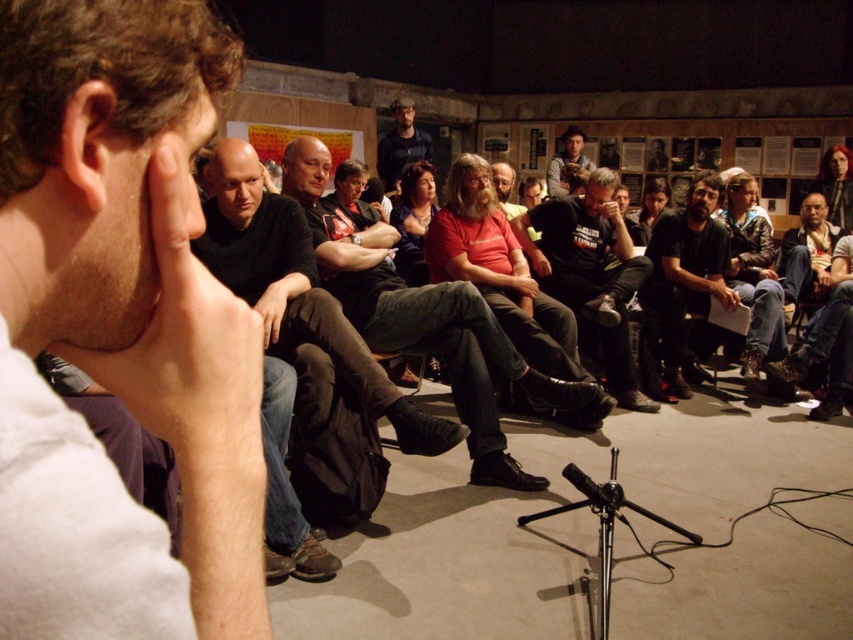
In the scene shown: You are organizing a photo shoot and need to arrange two models wearing the dark gray sweater at center and the dark blue shirt at center. Based on their current positions and sizes, which model should stand in front to ensure both are visible in the photo?

The dark gray sweater at center is taller than the dark blue shirt at center, so the model wearing the dark gray sweater at center should stand behind the one in the dark blue shirt at center to ensure both are visible.

Based on the scene description, where is the red matte shirt at center located in terms of coordinates?

The red matte shirt at center is located at coordinates approximately 0.503 in the x axis and 0.502 in the y axis.